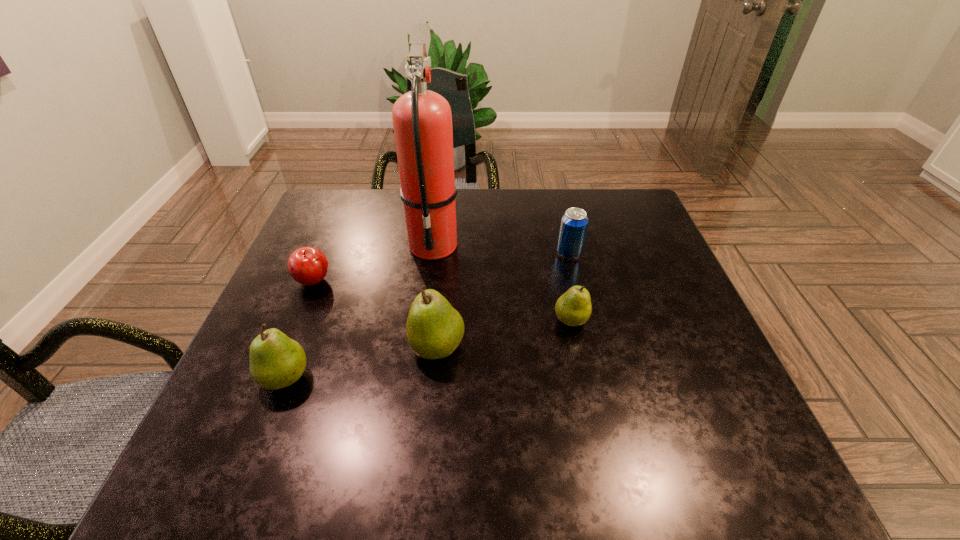
Where is `the leftmost pear`? the leftmost pear is located at coordinates (276, 361).

You are a GUI agent. You are given a task and a screenshot of the screen. Output one action in this format:
    pyautogui.click(x=<x>, y=<y>)
    Task: Click on the fifth shortest object
    The height and width of the screenshot is (540, 960).
    Given the screenshot: What is the action you would take?
    pyautogui.click(x=434, y=329)

Locate an element on the screen. Image resolution: width=960 pixels, height=540 pixels. the second pear from right to left is located at coordinates (434, 329).

Identify the location of the rightmost pear. Image resolution: width=960 pixels, height=540 pixels. pyautogui.click(x=573, y=308).

Where is `cherry`? Image resolution: width=960 pixels, height=540 pixels. cherry is located at coordinates (308, 266).

Identify the location of the tallest object. The image size is (960, 540). (422, 121).

Identify the location of beer can. (574, 222).

Where is `vacant space located on the back of the second tallest pear`? This screenshot has height=540, width=960. vacant space located on the back of the second tallest pear is located at coordinates (330, 262).

I want to click on free space located on the left of the fifth shortest object, so pos(336,347).

I want to click on blank space located on the left of the shortest pear, so click(530, 320).